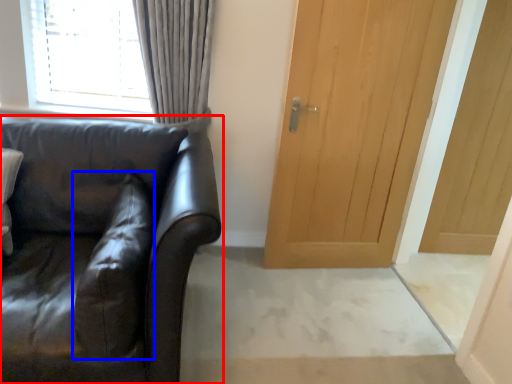
Question: Which object appears farthest to the camera in this image, studio couch (highlighted by a red box) or pillow (highlighted by a blue box)?

Choices:
 (A) studio couch
 (B) pillow

Answer: (B)